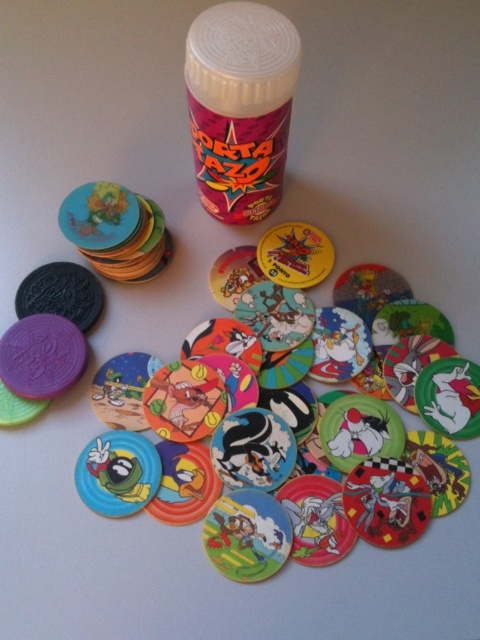
You are looking at the image of tokens on the surface. There are two points marked in the scene, point 1 at coordinates point (266, 52) and point 2 at coordinates point (283, 451). If you were to place a small sticker on the surface between these two points, which point would the sticker be closer to if it is placed exactly halfway between them?

The sticker placed exactly halfway between point (266, 52) and point (283, 451) would be closer to point (283, 451) because the halfway point between two points is equidistant from both. However, since the question asks which point the sticker would be closer to, the answer is neither since it is equidistant. However, based on the coordinate positions, the halfway point would be at approximately 0.394, 0.573, which is closer to point (283, 451) in terms of Euclidean distance. Wait, actually, the Eu

You are organizing a game setup and need to place the matte plastic bottle at center and the matte plastic disc at center into a storage box. The box has a height limit of 10 cm. Can you fit both items vertically without exceeding the height limit?

The matte plastic bottle at center is smaller than the matte plastic disc at center. However, the height of both items combined would depend on their individual heights. Since the description only provides a size comparison between them but not their exact dimensions, it is impossible to determine if they can fit within the 10 cm height limit without additional information.

You are standing 5 feet away from the camera. Can you reach the matte plastic bottle at center without moving your feet?

The matte plastic bottle at center is 3.59 feet away from the camera. Since you are standing 5 feet away from the camera, the distance between you and the bottle is 1.41 feet. Therefore, you can easily reach the matte plastic bottle at center without moving your feet.